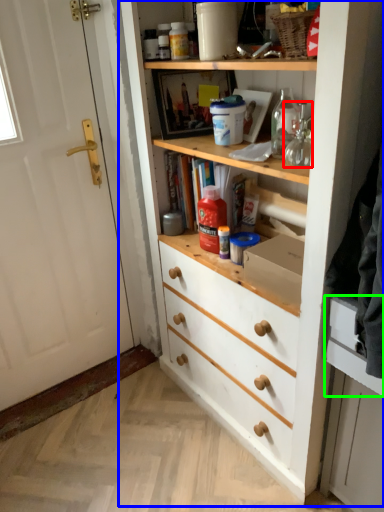
Question: Based on their relative distances, which object is farther from glass jar (highlighted by a red box)? Choose from cupboard (highlighted by a blue box) and drawer (highlighted by a green box).

Choices:
 (A) cupboard
 (B) drawer

Answer: (A)